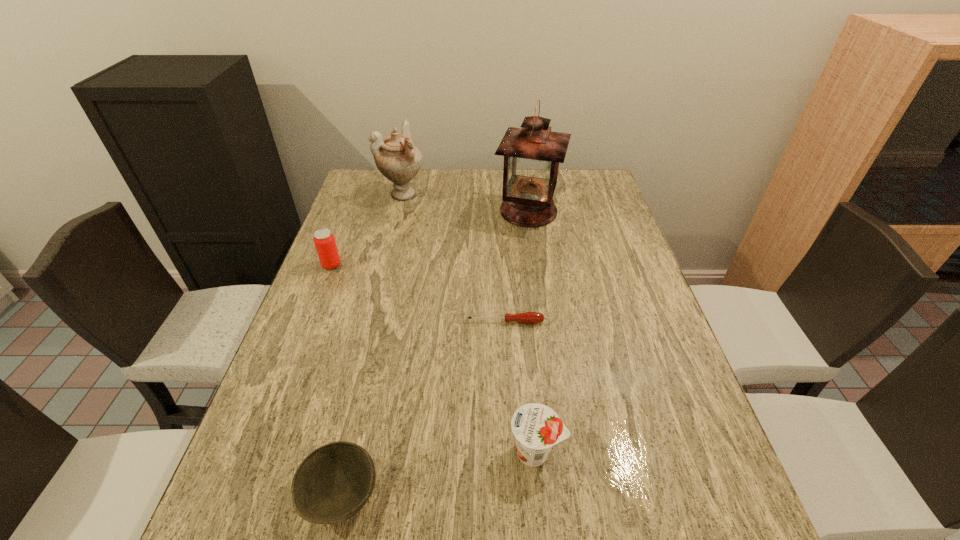
The width and height of the screenshot is (960, 540). Identify the location of the tallest object. (532, 154).

Identify the location of urn. This screenshot has height=540, width=960. (396, 157).

Locate an element on the screen. This screenshot has height=540, width=960. the leftmost object is located at coordinates (324, 240).

Locate an element on the screen. The width and height of the screenshot is (960, 540). the fourth nearest object is located at coordinates 324,240.

This screenshot has height=540, width=960. I want to click on the third shortest object, so click(536, 427).

This screenshot has height=540, width=960. What are the coordinates of `bowl` in the screenshot? It's located at [x=333, y=483].

Find the location of `screwdriver`. screwdriver is located at coordinates (528, 317).

Find the location of `the third nearest object`. the third nearest object is located at coordinates (528, 317).

The width and height of the screenshot is (960, 540). In order to click on vacant space located on the left of the oil lamp in this screenshot , I will do `click(413, 211)`.

The height and width of the screenshot is (540, 960). What are the coordinates of `vacant position located 0.260m on the front of the fifth shortest object` in the screenshot? It's located at (388, 257).